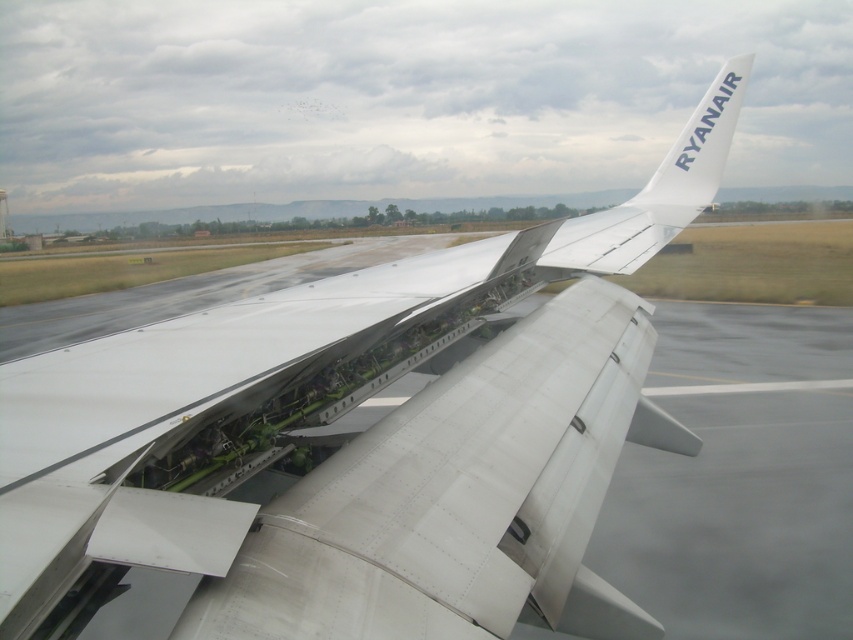
You are a maintenance worker inspecting an airplane. You notice the white metallic wing at center and the white matte airplane tail at upper right. Which object is nearer to you?

The white metallic wing at center is closer to the viewer than the white matte airplane tail at upper right.

You are a maintenance technician inspecting an airplane. You notice the white metallic wing at center and the white matte airplane tail at upper right. Which object is positioned lower in the image?

The white metallic wing at center is located below the white matte airplane tail at upper right, so it is positioned lower in the image.

You are a pilot preparing for landing and notice the white metallic wing at center and the white matte airplane tail at upper right. Which object is positioned further to the left from your perspective?

The white metallic wing at center is positioned to the left of the white matte airplane tail at upper right, so it is further to the left.